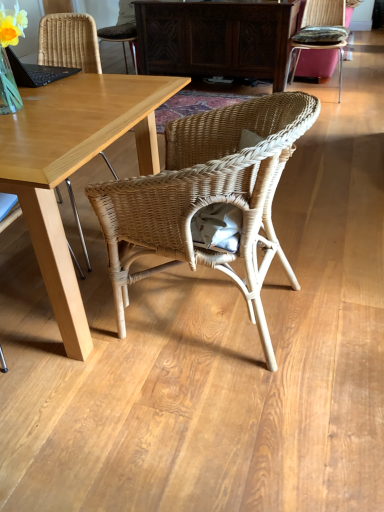
Question: From the image's perspective, relative to light wood desk at center, is woven wicker chair at center, which ranks as the 2th chair in back-to-front order, above or below?

Choices:
 (A) above
 (B) below

Answer: (A)

Question: Considering the positions of woven wicker chair at center, which ranks as the 3th chair in right-to-left order, and light wood desk at center in the image, is woven wicker chair at center, which ranks as the 3th chair in right-to-left order, taller or shorter than light wood desk at center?

Choices:
 (A) tall
 (B) short

Answer: (A)

Question: Estimate the real-world distances between objects in this image. Which object is farther from the dark wood cabinet at center?

Choices:
 (A) light wood desk at center
 (B) woven wicker chair at center, the 1th chair positioned from the left
 (C) rattan cushion at upper right, arranged as the 3th chair when viewed from the left
 (D) natural wicker chair at center, which is counted as the 3th chair, starting from the top

Answer: (D)

Question: Estimate the real-world distances between objects in this image. Which object is farther from the light wood desk at center?

Choices:
 (A) dark wood cabinet at center
 (B) woven wicker chair at center, the 2th chair ordered from the bottom
 (C) rattan cushion at upper right, arranged as the 3th chair when viewed from the left
 (D) natural wicker chair at center, arranged as the 2th chair when viewed from the left

Answer: (C)